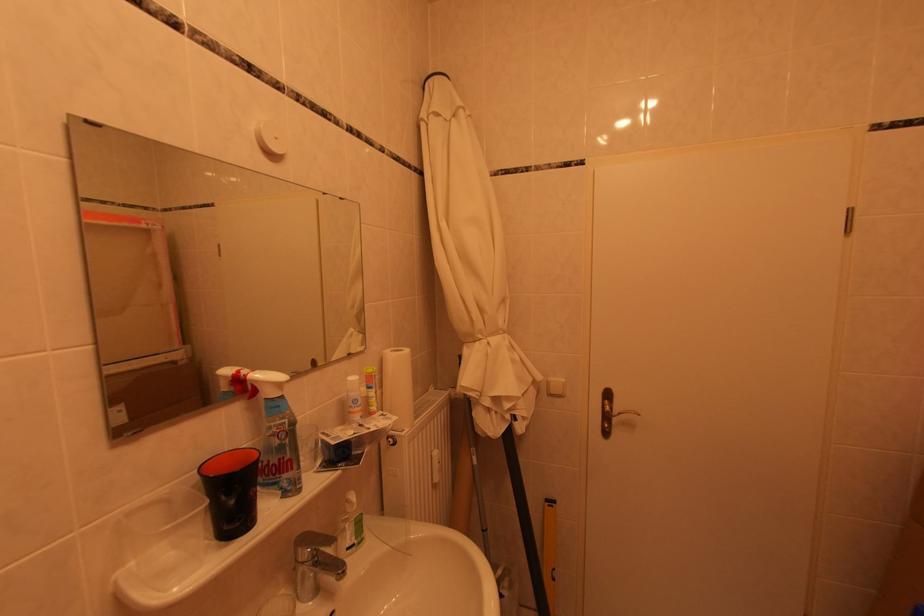
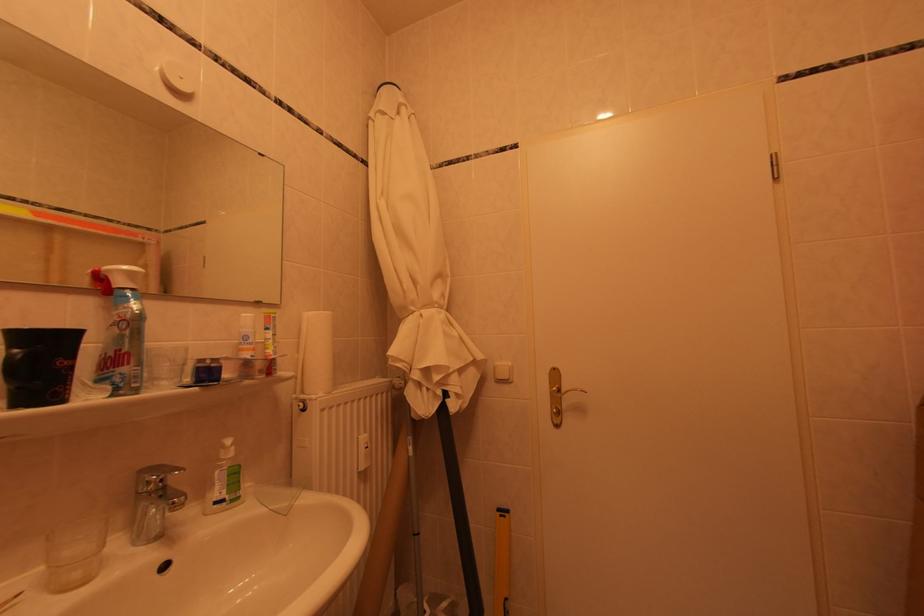
Where in the second image is the point corresponding to point (289, 496) from the first image?

(119, 391)